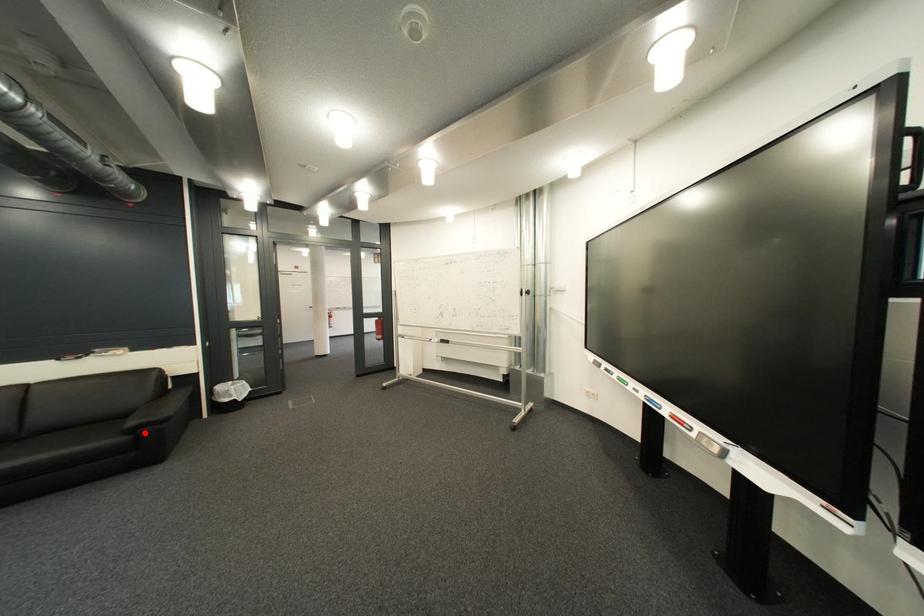
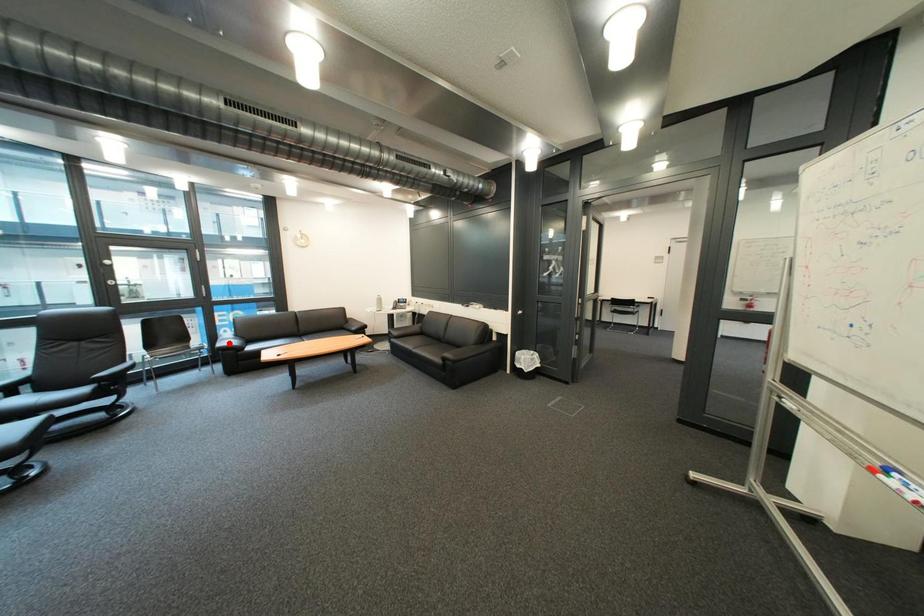
I am providing you with two images of the same scene from different viewpoints. A red point is marked on the first image and another point is marked on the second image. Are the points marked in image1 and image2 representing the same 3D position?

No